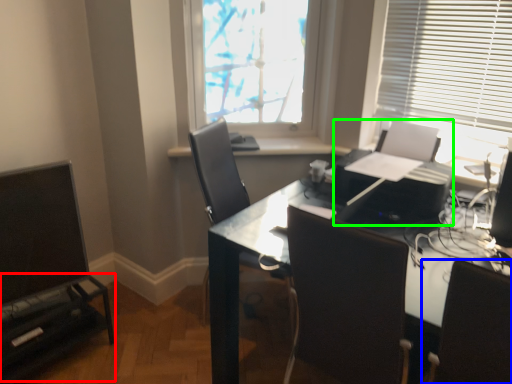
Question: Which is farther away from entertainment center (highlighted by a red box)? chair (highlighted by a blue box) or printer (highlighted by a green box)?

Choices:
 (A) chair
 (B) printer

Answer: (A)